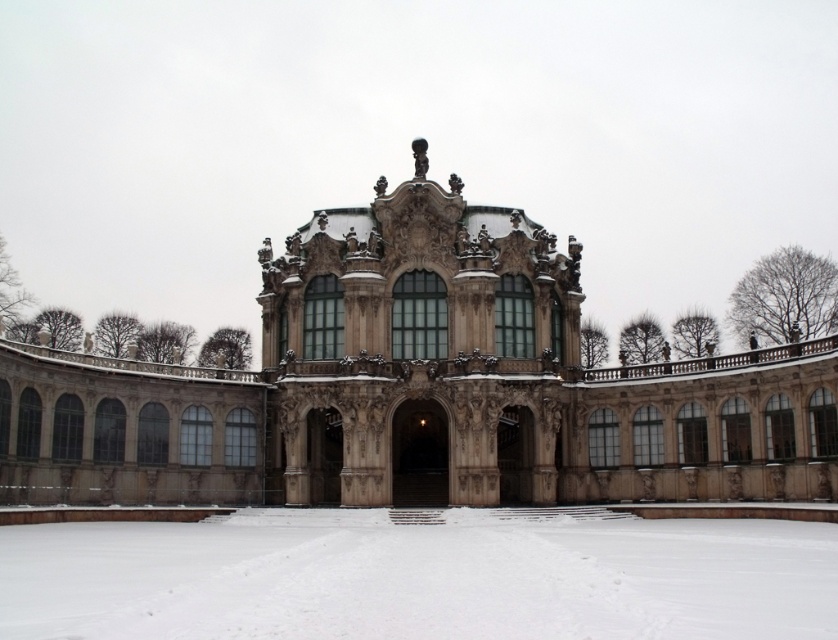
Measure the distance between brown stone palace at center and white powdery snow at center.

brown stone palace at center is 16.52 meters from white powdery snow at center.

Who is shorter, brown stone palace at center or white powdery snow at center?

Standing shorter between the two is white powdery snow at center.

The image size is (838, 640). What do you see at coordinates (417, 387) in the screenshot?
I see `brown stone palace at center` at bounding box center [417, 387].

At what (x,y) coordinates should I click in order to perform the action: click on brown stone palace at center. Please return your answer as a coordinate pair (x, y). The image size is (838, 640). Looking at the image, I should click on (417, 387).